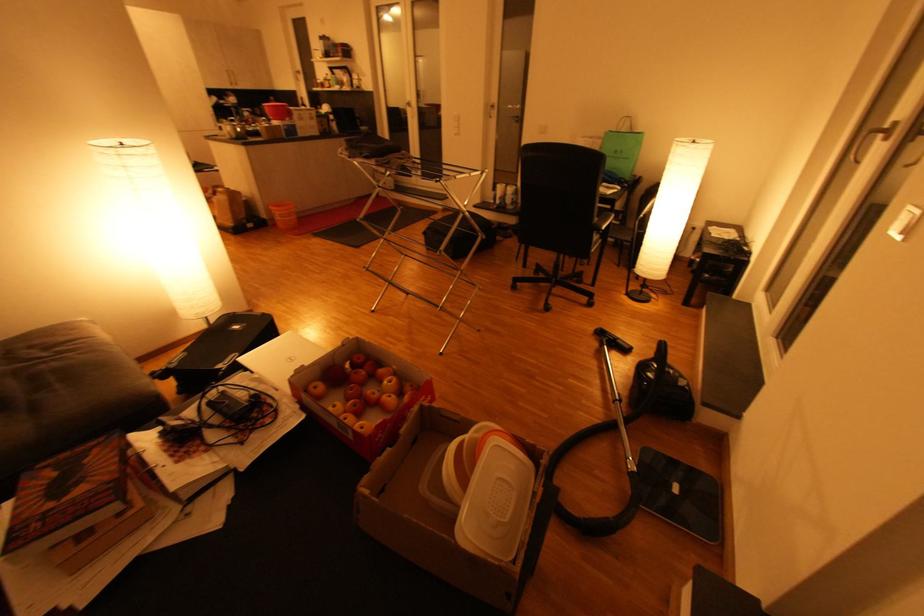
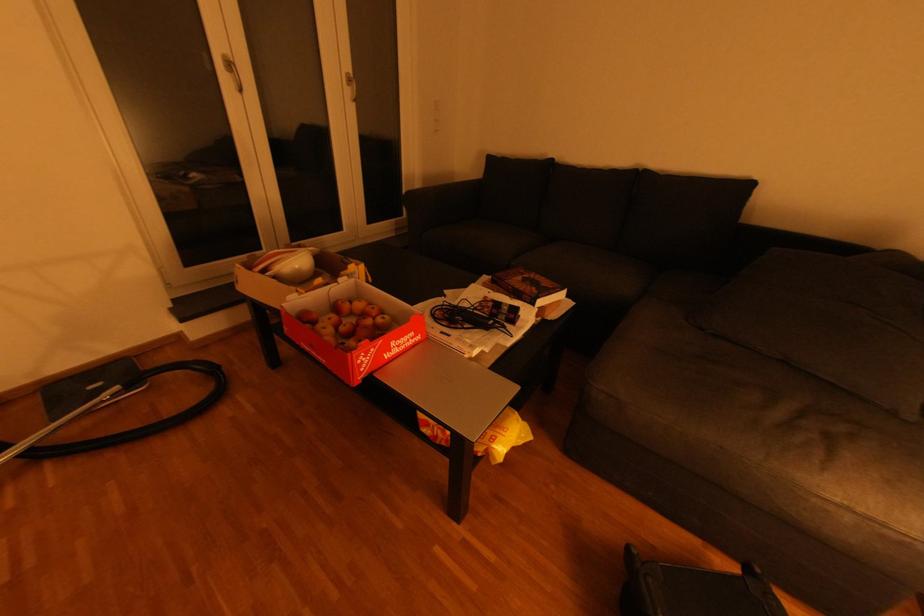
Find the pixel in the second image that matches (x=91, y=463) in the first image.

(539, 289)